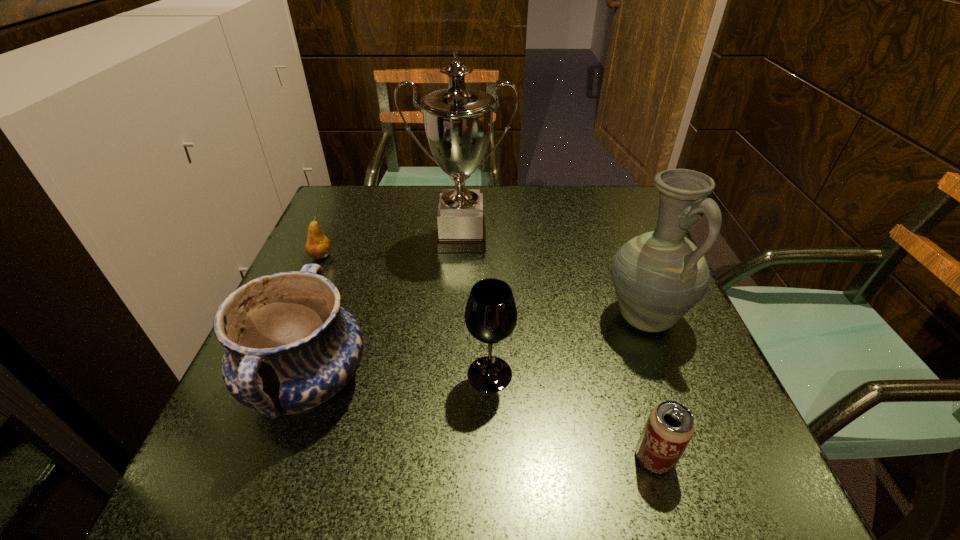
Locate an element on the screen. the tallest object is located at coordinates (458, 121).

This screenshot has height=540, width=960. In order to click on pitcher in this screenshot , I will do coord(658,276).

Find the location of a particular element. wineglass is located at coordinates (491, 315).

Where is `pottery`? Image resolution: width=960 pixels, height=540 pixels. pottery is located at coordinates (290, 346).

Find the location of a particular element. The image size is (960, 540). pear is located at coordinates tap(318, 246).

You are a GUI agent. You are given a task and a screenshot of the screen. Output one action in this format:
    pyautogui.click(x=<x>, y=<y>)
    Task: Click on the beer can
    This screenshot has height=540, width=960.
    Given the screenshot: What is the action you would take?
    pyautogui.click(x=670, y=426)

You are a GUI agent. You are given a task and a screenshot of the screen. Output one action in this format:
    pyautogui.click(x=<x>, y=<y>)
    Task: Click on the vacant position located 0.120m at the front view of the trophy cup
    The width and height of the screenshot is (960, 540).
    Given the screenshot: What is the action you would take?
    pyautogui.click(x=458, y=294)

Find the location of a particular element. vacant space located on the handle side of the second tallest object is located at coordinates (669, 381).

At what (x,y) coordinates should I click in order to perform the action: click on vacant space located on the front of the wineglass. Please return your answer as a coordinate pair (x, y). The width and height of the screenshot is (960, 540). Looking at the image, I should click on (492, 475).

Where is `free space located on the right of the pottery`? The image size is (960, 540). free space located on the right of the pottery is located at coordinates (570, 381).